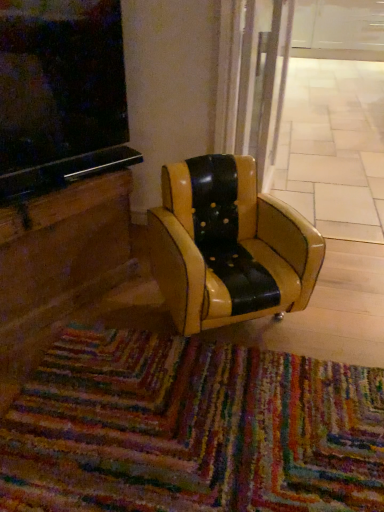
What do you see at coordinates (315, 109) in the screenshot?
I see `transparent glass door at center` at bounding box center [315, 109].

Measure the distance between point (203, 196) and camera.

Point (203, 196) is 1.54 meters away from camera.

Image resolution: width=384 pixels, height=512 pixels. I want to click on transparent glass door at center, so click(315, 109).

Does black leather chair at center come behind transparent glass door at center?

No, black leather chair at center is closer to the camera.

Does black leather chair at center touch transparent glass door at center?

No, black leather chair at center is not touching transparent glass door at center.

How different are the orientations of black leather chair at center and transparent glass door at center in degrees?

33.7 degrees separate the facing orientations of black leather chair at center and transparent glass door at center.

Is point (199, 320) farther from viewer compared to point (363, 133)?

No, it is not.

Looking at this image, from a real-world perspective, is transparent glass door at center above or below black leather chair at center?

Clearly, from a real-world perspective, transparent glass door at center is below black leather chair at center.

What's the angular difference between transparent glass door at center and black leather chair at center's facing directions?

The angular difference between transparent glass door at center and black leather chair at center is 33.7 degrees.

Is transparent glass door at center not near black leather chair at center?

Absolutely, transparent glass door at center is distant from black leather chair at center.

From a real-world perspective, does black leather chair at center sit lower than multicolored woven mat at lower center?

Incorrect, from a real-world perspective, black leather chair at center is higher than multicolored woven mat at lower center.

Based on the photo, is black leather chair at center directly adjacent to multicolored woven mat at lower center?

No, black leather chair at center is not touching multicolored woven mat at lower center.

Which is in front, black leather chair at center or multicolored woven mat at lower center?

multicolored woven mat at lower center is in front.

Which is more to the right, multicolored woven mat at lower center or transparent glass door at center?

transparent glass door at center.

In terms of height, does multicolored woven mat at lower center look taller or shorter compared to transparent glass door at center?

Considering their sizes, multicolored woven mat at lower center has less height than transparent glass door at center.

From a real-world perspective, is multicolored woven mat at lower center positioned over transparent glass door at center based on gravity?

Indeed, from a real-world perspective, multicolored woven mat at lower center stands above transparent glass door at center.

Is multicolored woven mat at lower center not within transparent glass door at center?

multicolored woven mat at lower center lies outside transparent glass door at center's area.

In the image, there is a transparent glass door at center. Where is `mat below it (from the image's perspective)`? This screenshot has width=384, height=512. mat below it (from the image's perspective) is located at coordinates (190, 429).

Considering the positions of objects transparent glass door at center and multicolored woven mat at lower center in the image provided, who is behind, transparent glass door at center or multicolored woven mat at lower center?

transparent glass door at center is further away from the camera.

Which point is more distant from viewer, (327, 103) or (8, 489)?

The point (327, 103) is farther.

From a real-world perspective, is transparent glass door at center positioned under multicolored woven mat at lower center based on gravity?

Indeed, from a real-world perspective, transparent glass door at center is positioned beneath multicolored woven mat at lower center.

From a real-world perspective, is multicolored woven mat at lower center above or below black leather chair at center?

multicolored woven mat at lower center is below black leather chair at center.

Considering the relative positions of multicolored woven mat at lower center and black leather chair at center in the image provided, is multicolored woven mat at lower center behind black leather chair at center?

That is False.

You are a GUI agent. You are given a task and a screenshot of the screen. Output one action in this format:
    pyautogui.click(x=<x>, y=<y>)
    Task: Click on the chair behind the multicolored woven mat at lower center
    
    Given the screenshot: What is the action you would take?
    pyautogui.click(x=228, y=246)

Measure the distance between multicolored woven mat at lower center and black leather chair at center.

A distance of 15.36 inches exists between multicolored woven mat at lower center and black leather chair at center.

You are a GUI agent. You are given a task and a screenshot of the screen. Output one action in this format:
    pyautogui.click(x=<x>, y=<y>)
    Task: Click on the chair that is on the left side of transparent glass door at center
    
    Given the screenshot: What is the action you would take?
    pyautogui.click(x=228, y=246)

Locate an element on the screen. shop window above the black leather chair at center (from the image's perspective) is located at coordinates (315, 109).

When comparing their distances from multicolored woven mat at lower center, does transparent glass door at center or black leather chair at center seem closer?

black leather chair at center is positioned closer to the anchor multicolored woven mat at lower center.

Looking at the image, which one is located closer to black leather chair at center, transparent glass door at center or multicolored woven mat at lower center?

multicolored woven mat at lower center is positioned closer to the anchor black leather chair at center.

When comparing their distances from transparent glass door at center, does black leather chair at center or multicolored woven mat at lower center seem closer?

black leather chair at center.

Which object lies further to the anchor point black leather chair at center, multicolored woven mat at lower center or transparent glass door at center?

Based on the image, transparent glass door at center appears to be further to black leather chair at center.

Estimate the real-world distances between objects in this image. Which object is closer to transparent glass door at center, multicolored woven mat at lower center or black leather chair at center?

The object closer to transparent glass door at center is black leather chair at center.

Based on their spatial positions, is black leather chair at center or transparent glass door at center further from multicolored woven mat at lower center?

transparent glass door at center is positioned further to the anchor multicolored woven mat at lower center.

Where is `chair between transparent glass door at center and multicolored woven mat at lower center vertically`? chair between transparent glass door at center and multicolored woven mat at lower center vertically is located at coordinates (228, 246).